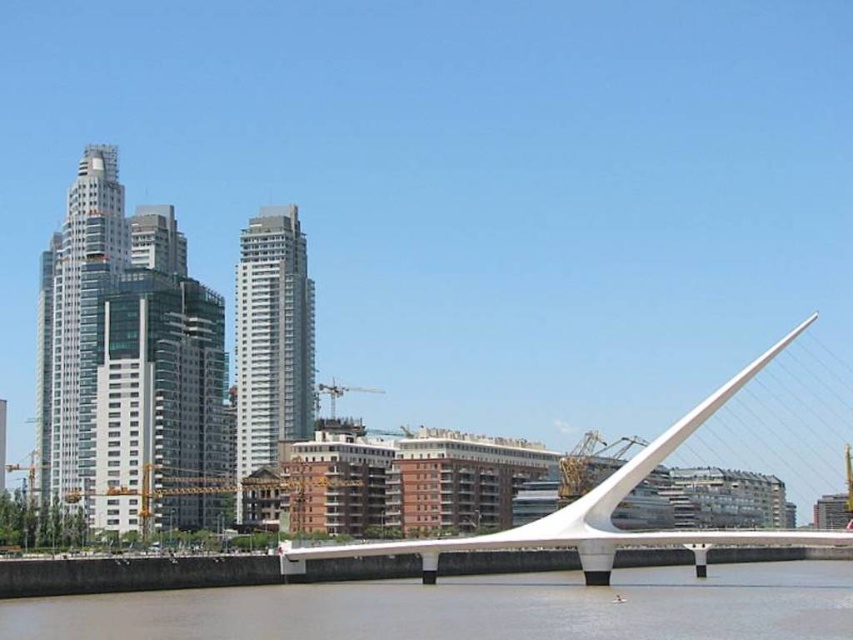
Question: Where is brown sedimentary water at lower center located in relation to white metallic bridge at center in the image?

Choices:
 (A) right
 (B) left

Answer: (B)

Question: Does brown sedimentary water at lower center appear over white metallic bridge at center?

Choices:
 (A) yes
 (B) no

Answer: (A)

Question: In this image, where is brown sedimentary water at lower center located relative to white metallic bridge at center?

Choices:
 (A) left
 (B) right

Answer: (A)